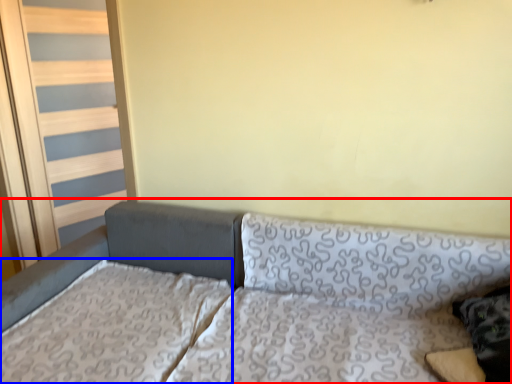
Question: Among these objects, which one is farthest to the camera, studio couch (highlighted by a red box) or mattress (highlighted by a blue box)?

Choices:
 (A) studio couch
 (B) mattress

Answer: (B)